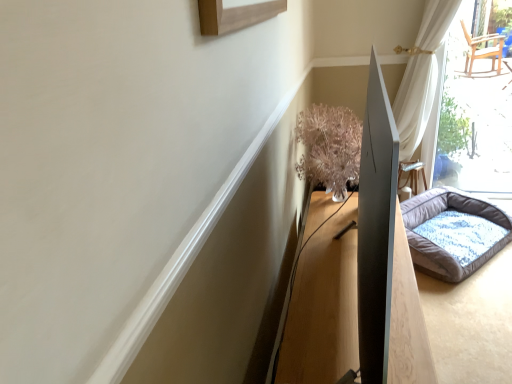
Question: Is fluffy gray dog bed at right turned away from wooden table at center?

Choices:
 (A) yes
 (B) no

Answer: (B)

Question: Does fluffy gray dog bed at right have a larger size compared to wooden table at center?

Choices:
 (A) no
 (B) yes

Answer: (A)

Question: Can you confirm if fluffy gray dog bed at right is positioned to the right of wooden table at center?

Choices:
 (A) no
 (B) yes

Answer: (B)

Question: From a real-world perspective, is fluffy gray dog bed at right on wooden table at center?

Choices:
 (A) yes
 (B) no

Answer: (A)

Question: Is the surface of fluffy gray dog bed at right in direct contact with wooden table at center?

Choices:
 (A) no
 (B) yes

Answer: (A)

Question: Considering the relative sizes of fluffy gray dog bed at right and wooden table at center in the image provided, is fluffy gray dog bed at right taller than wooden table at center?

Choices:
 (A) yes
 (B) no

Answer: (A)

Question: Is the surface of wooden table at center in direct contact with fluffy gray dog bed at right?

Choices:
 (A) yes
 (B) no

Answer: (B)

Question: From the image's perspective, is wooden table at center beneath fluffy gray dog bed at right?

Choices:
 (A) yes
 (B) no

Answer: (A)

Question: From a real-world perspective, is wooden table at center over fluffy gray dog bed at right?

Choices:
 (A) yes
 (B) no

Answer: (B)

Question: Considering the relative positions of wooden table at center and fluffy gray dog bed at right in the image provided, is wooden table at center in front of fluffy gray dog bed at right?

Choices:
 (A) yes
 (B) no

Answer: (A)

Question: Considering the relative sizes of wooden table at center and fluffy gray dog bed at right in the image provided, is wooden table at center taller than fluffy gray dog bed at right?

Choices:
 (A) yes
 (B) no

Answer: (B)

Question: Is wooden table at center turned away from fluffy gray dog bed at right?

Choices:
 (A) no
 (B) yes

Answer: (A)

Question: Is fluffy gray dog bed at right surrounding translucent glass vase at upper right?

Choices:
 (A) no
 (B) yes

Answer: (A)